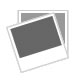
Locate an element on the screen. picture is located at coordinates (46, 34), (59, 17).